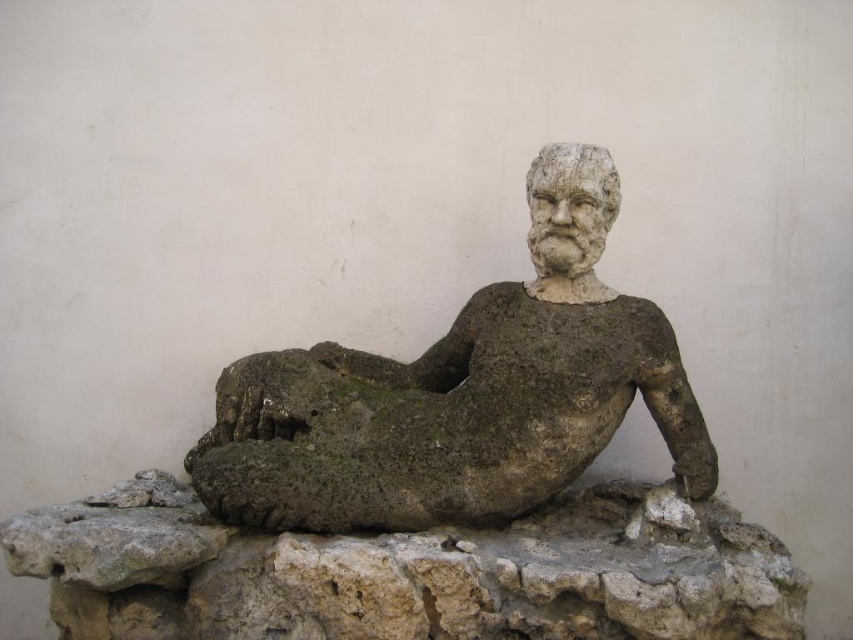
Between gray stone reclining figure at center and gray stone at center, which one has more height?

gray stone reclining figure at center is taller.

Can you confirm if gray stone reclining figure at center is wider than gray stone at center?

No, gray stone reclining figure at center is not wider than gray stone at center.

Is point (418, 525) farther from camera compared to point (444, 636)?

Yes, point (418, 525) is farther from viewer.

Where is `gray stone reclining figure at center`? This screenshot has height=640, width=853. gray stone reclining figure at center is located at coordinates (461, 394).